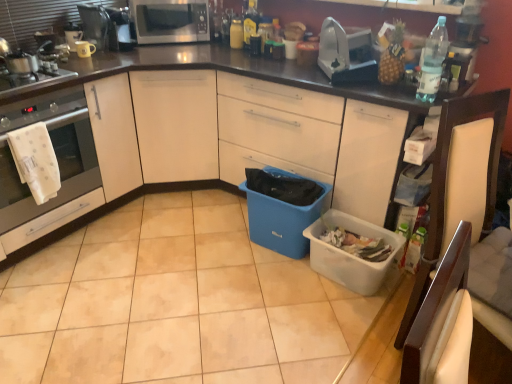
Question: From a real-world perspective, relative to clear plastic bottle at upper right, the first bottle from the bottom, is yellow matte mug at upper left, which is counted as the 4th appliance, starting from the right, vertically above or below?

Choices:
 (A) below
 (B) above

Answer: (A)

Question: In terms of height, does yellow matte mug at upper left, which appears as the second appliance when viewed from the left, look taller or shorter compared to clear plastic bottle at upper right, which is the 3th bottle in top-to-bottom order?

Choices:
 (A) short
 (B) tall

Answer: (A)

Question: Which of these objects is positioned closest to the white glossy oven at left?

Choices:
 (A) yellow matte mug at upper left, which is counted as the 4th appliance, starting from the right
 (B) clear plastic bottle at upper right, which appears as the 1th bottle when viewed from the right
 (C) white plastic storage box at lower right, which is counted as the first storage box, starting from the right
 (D) satin silver toaster at upper right, which is counted as the 5th appliance, starting from the left
 (E) metallic silver coffee maker at upper left, which is counted as the 4th appliance, starting from the left

Answer: (A)

Question: Based on their relative distances, which object is nearer to the matte white coffee cup at upper left, which is the fifth appliance from right to left?

Choices:
 (A) white leather chair at right
 (B) beige tile at center
 (C) yellow matte bottle at upper center, which appears as the first bottle when viewed from the back
 (D) yellow matte mug at upper left, which is counted as the 4th appliance, starting from the right
 (E) metallic silver coffee maker at upper left, which is counted as the 4th appliance, starting from the left

Answer: (D)